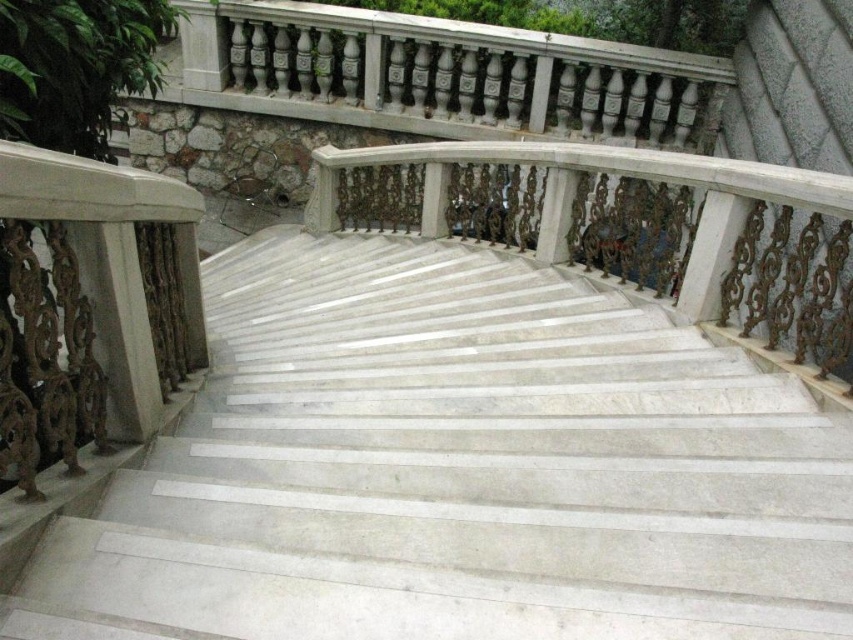
Question: Which of the following is the closest to the observer?

Choices:
 (A) white marble stairs at center
 (B) white marble balustrade at center

Answer: (A)

Question: Does white marble stairs at center have a greater width compared to white marble balustrade at center?

Choices:
 (A) yes
 (B) no

Answer: (B)

Question: Which point is farther from the camera taking this photo?

Choices:
 (A) (767, 198)
 (B) (788, 452)

Answer: (A)

Question: Is white marble stairs at center above white marble balustrade at center?

Choices:
 (A) yes
 (B) no

Answer: (B)

Question: Does white marble stairs at center have a smaller size compared to white marble balustrade at center?

Choices:
 (A) no
 (B) yes

Answer: (B)